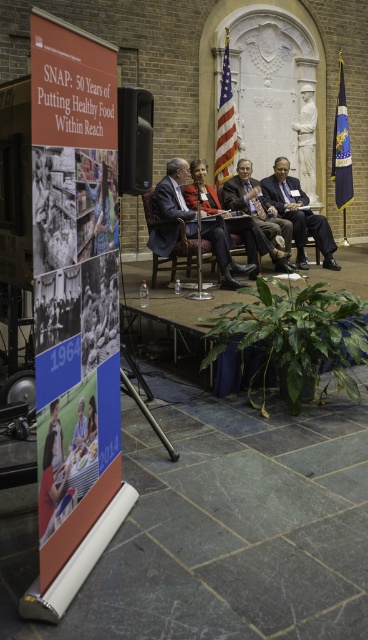
Question: Does wooden chair at center appear over dark wood chair at center?

Choices:
 (A) no
 (B) yes

Answer: (A)

Question: Which of these objects is positioned closest to the matte black suit at center?

Choices:
 (A) dark wood chair at center
 (B) dark blue suit at center

Answer: (A)

Question: Does orange matte poster at left appear on the right side of matte black suit at center?

Choices:
 (A) no
 (B) yes

Answer: (A)

Question: Which object appears closest to the camera in this image?

Choices:
 (A) orange matte poster at left
 (B) dark wood chair at center
 (C) dark gray suit at center

Answer: (A)

Question: Is orange matte poster at left closer to camera compared to matte black suit at center?

Choices:
 (A) no
 (B) yes

Answer: (B)

Question: Estimate the real-world distances between objects in this image. Which object is closer to the wooden chair at center?

Choices:
 (A) dark gray suit at center
 (B) orange matte poster at left
 (C) matte black suit at center
 (D) dark blue suit at center

Answer: (C)